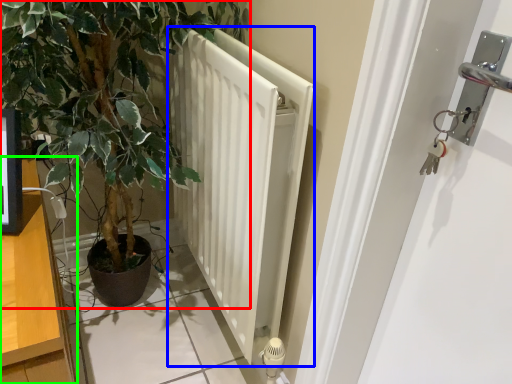
Question: Considering the real-world distances, which object is farthest from houseplant (highlighted by a red box)? radiator (highlighted by a blue box) or dresser (highlighted by a green box)?

Choices:
 (A) radiator
 (B) dresser

Answer: (B)